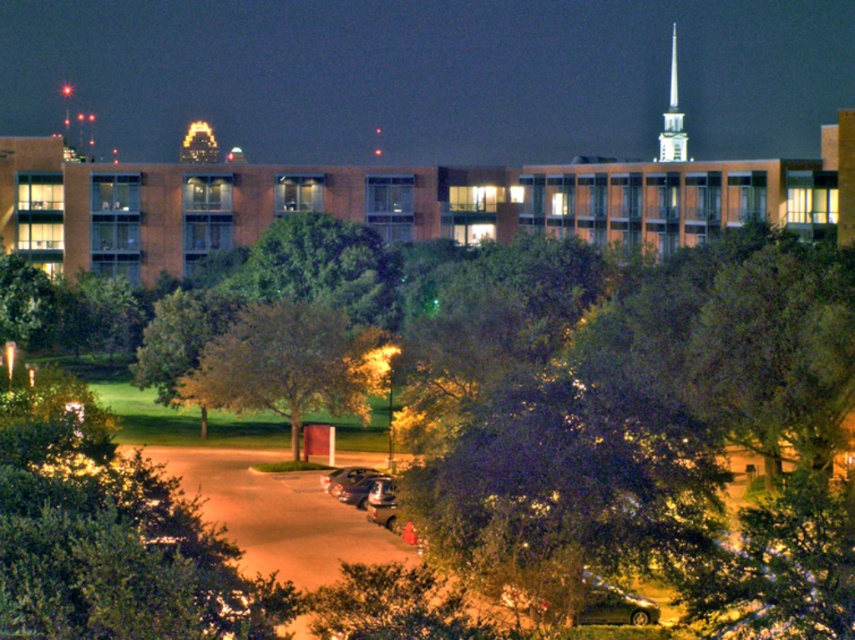
Question: Which point appears closest to the camera in this image?

Choices:
 (A) (677, 154)
 (B) (223, 336)

Answer: (B)

Question: Is green leafy tree at center positioned at the back of silver metallic spire at upper right?

Choices:
 (A) yes
 (B) no

Answer: (B)

Question: Which of the following is the closest to the observer?

Choices:
 (A) (258, 372)
 (B) (684, 157)

Answer: (A)

Question: Observing the image, what is the correct spatial positioning of green leafy tree at center in reference to silver metallic spire at upper right?

Choices:
 (A) above
 (B) below

Answer: (B)

Question: Observing the image, what is the correct spatial positioning of green leafy tree at center in reference to silver metallic spire at upper right?

Choices:
 (A) below
 (B) above

Answer: (A)